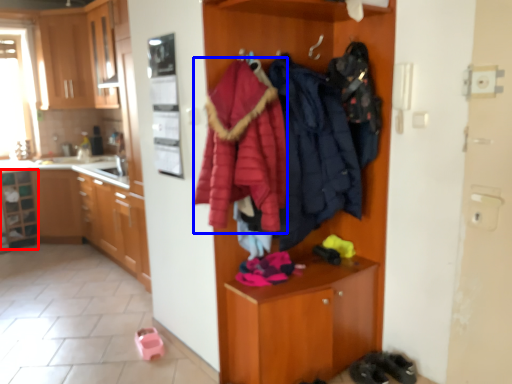
Question: Which of the following is the closest to the observer, shelf (highlighted by a red box) or bathrobe (highlighted by a blue box)?

Choices:
 (A) shelf
 (B) bathrobe

Answer: (B)